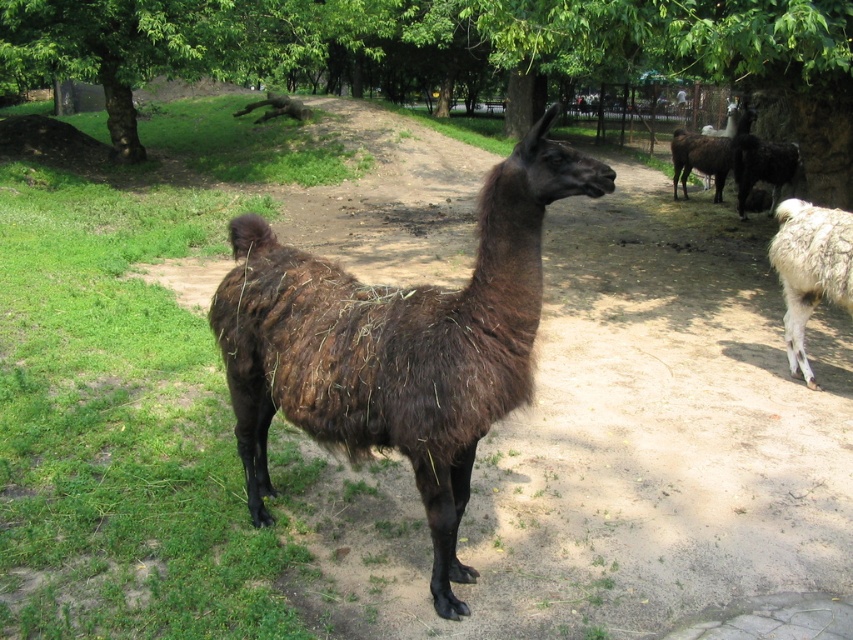
Question: Which of the following is the closest to the observer?

Choices:
 (A) (838, 266)
 (B) (213, 321)

Answer: (B)

Question: Is white woolly alpaca at right closer to the viewer compared to dark brown woolly alpaca at upper right?

Choices:
 (A) yes
 (B) no

Answer: (A)

Question: Can you confirm if brown fuzzy alpaca at center is positioned to the left of dark brown woolly alpaca at upper right?

Choices:
 (A) yes
 (B) no

Answer: (A)

Question: Does brown fuzzy alpaca at center appear under dark brown woolly alpaca at upper right?

Choices:
 (A) yes
 (B) no

Answer: (A)

Question: Among these points, which one is farthest from the camera?

Choices:
 (A) (790, 225)
 (B) (509, 257)
 (C) (682, 129)

Answer: (C)

Question: Which point is farther to the camera?

Choices:
 (A) (674, 148)
 (B) (830, 296)

Answer: (A)